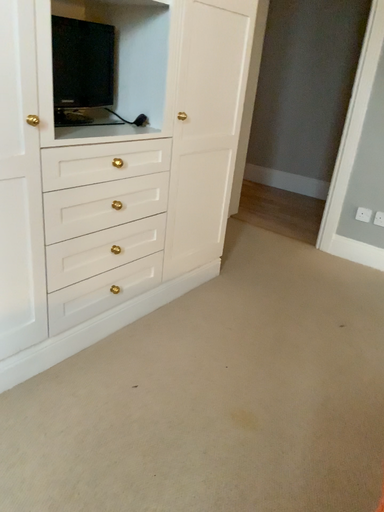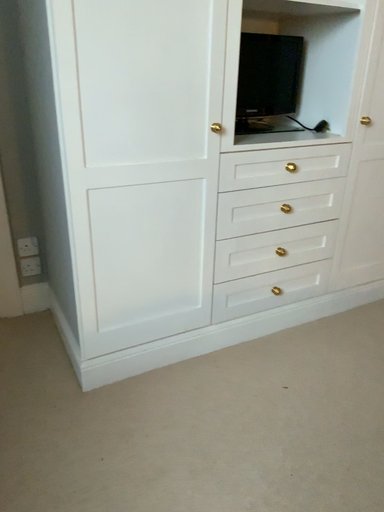
Question: Which way did the camera rotate in the video?

Choices:
 (A) rotated right
 (B) rotated left

Answer: (B)